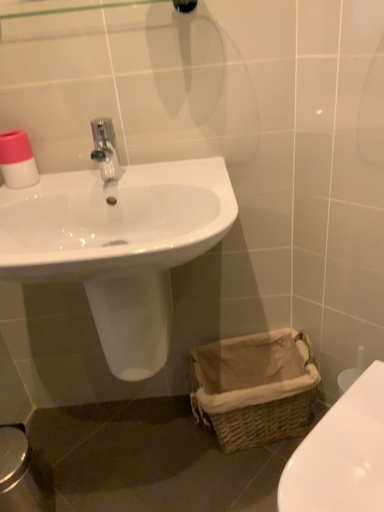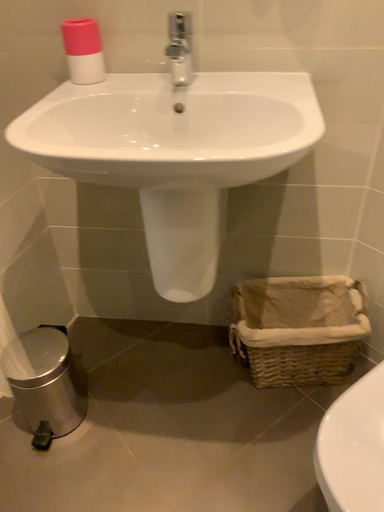
Question: Which way did the camera rotate in the video?

Choices:
 (A) rotated upward
 (B) rotated downward

Answer: (B)